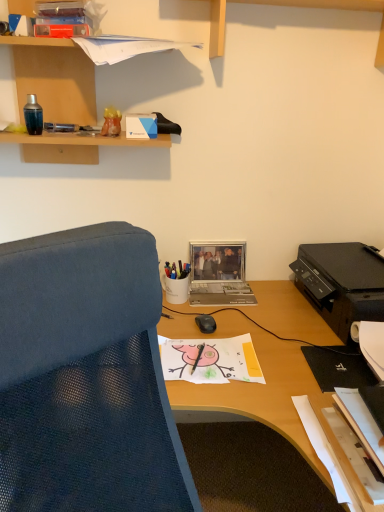
Locate an element on the screen. free space behind black matte pen at center, the first pen from the right is located at coordinates (198, 344).